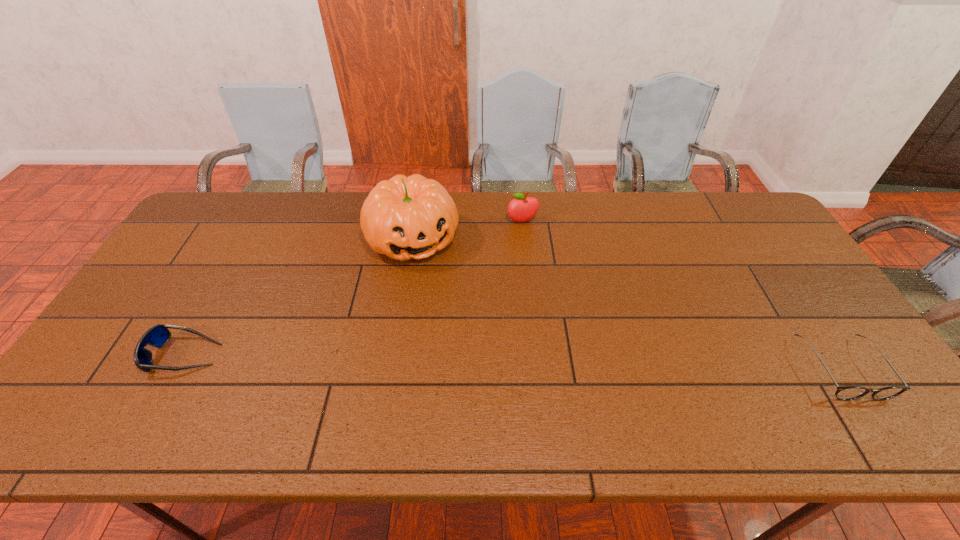
The image size is (960, 540). I want to click on free space on the desktop that is between the sunglasses and the shortest object and is positioned on the front-facing side of the second object from right to left, so click(561, 362).

Find the location of a particular element. free space on the desktop that is between the leftmost object and the spectacles and is positioned on the carved face of the pumpkin is located at coordinates (474, 361).